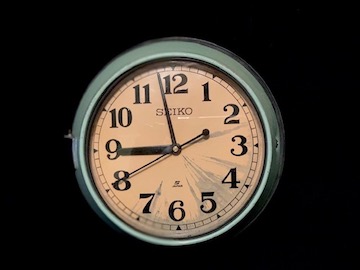
You are a GUI agent. You are given a task and a screenshot of the screen. Output one action in this format:
    pyautogui.click(x=<x>, y=<y>)
    Task: Click on the clock dial
    
    Given the screenshot: What is the action you would take?
    pyautogui.click(x=198, y=154)